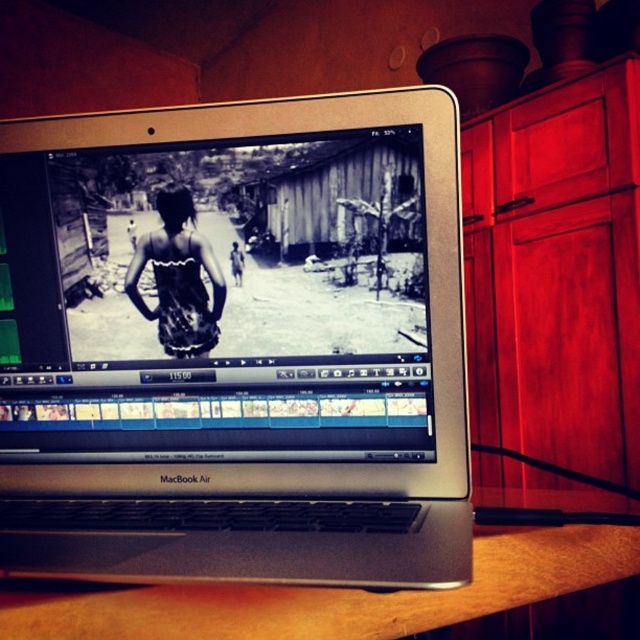
Question: Does silver metallic laptop at center have a larger size compared to wooden table at lower center?

Choices:
 (A) yes
 (B) no

Answer: (A)

Question: Which object is farther from the camera taking this photo?

Choices:
 (A) black textured dress at center
 (B) wooden table at lower center

Answer: (A)

Question: Can you confirm if silver metallic laptop at center is positioned below wooden table at lower center?

Choices:
 (A) yes
 (B) no

Answer: (B)

Question: Considering the real-world distances, which object is closest to the black textured dress at center?

Choices:
 (A) silver metallic laptop at center
 (B) wooden table at lower center

Answer: (A)

Question: Based on their relative distances, which object is farther from the black textured dress at center?

Choices:
 (A) silver metallic laptop at center
 (B) wooden table at lower center

Answer: (B)

Question: Observing the image, what is the correct spatial positioning of wooden table at lower center in reference to black textured dress at center?

Choices:
 (A) left
 (B) right

Answer: (B)